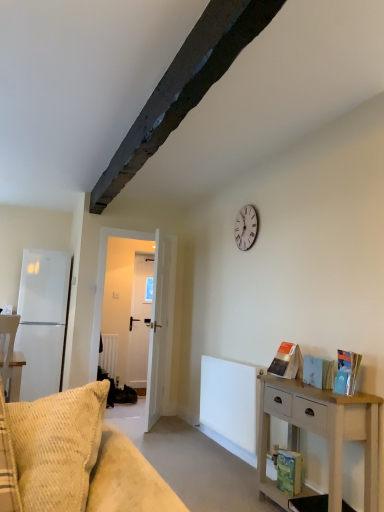
Question: Is hardcover book at right, marked as the 4th book in a back-to-front arrangement, spatially inside white ribbed radiator at center, or outside of it?

Choices:
 (A) inside
 (B) outside

Answer: (B)

Question: Visually, is hardcover book at right, the 1th book from the front, positioned to the left or to the right of white ribbed radiator at center?

Choices:
 (A) left
 (B) right

Answer: (B)

Question: Estimate the real-world distances between objects in this image. Which object is closer to the white wooden door at center?

Choices:
 (A) hardcover book at right, marked as the 4th book in a back-to-front arrangement
 (B) light wood nightstand at right
 (C) white matte refrigerator at left
 (D) orange matte book at right, which is counted as the 1th book, starting from the back
 (E) white ribbed radiator at center

Answer: (C)

Question: Considering the real-world distances, which object is closest to the white ribbed radiator at center?

Choices:
 (A) light wood nightstand at right
 (B) white matte refrigerator at left
 (C) orange matte book at right, which ranks as the third book in top-to-bottom order
 (D) white wooden clock at upper center
 (E) hardcover book at lower right, the first book ordered from the bottom

Answer: (A)